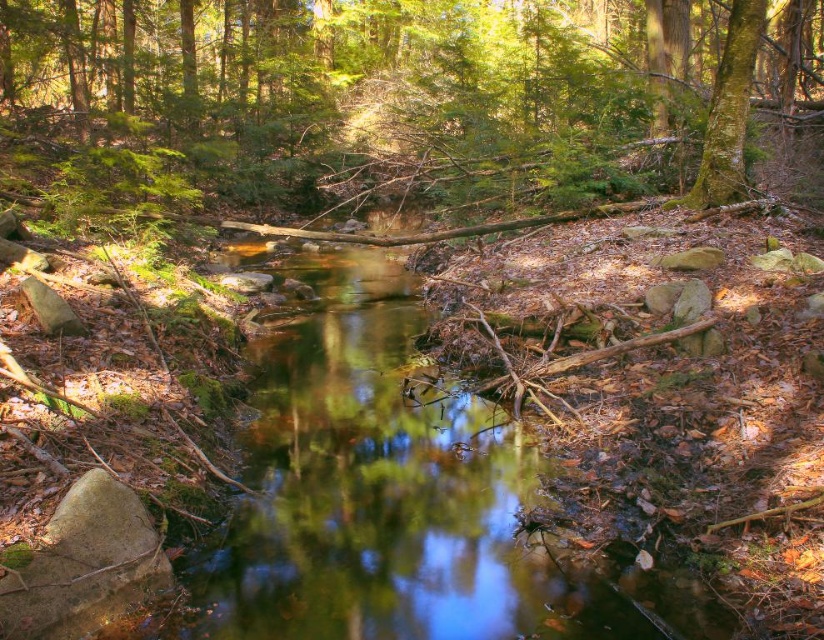
How distant is green matte tree at center from green mossy tree at upper right?

They are 30.10 feet apart.

Does green matte tree at center have a smaller size compared to green mossy tree at upper right?

No, green matte tree at center is not smaller than green mossy tree at upper right.

Between point (302, 154) and point (737, 77), which one is positioned behind?

Positioned behind is point (302, 154).

Where is `green matte tree at center`? green matte tree at center is located at coordinates (406, 99).

Is green matte tree at center wider than green reflective water at center?

Yes.

Between green matte tree at center and green reflective water at center, which one appears on the left side from the viewer's perspective?

green reflective water at center is more to the left.

The image size is (824, 640). What do you see at coordinates (406, 99) in the screenshot? I see `green matte tree at center` at bounding box center [406, 99].

Find the location of a particular element. The height and width of the screenshot is (640, 824). green matte tree at center is located at coordinates (406, 99).

Is point (405, 486) farther from camera compared to point (750, 17)?

No, it is in front of (750, 17).

Does green reflective water at center have a greater width compared to green mossy tree at upper right?

No, green reflective water at center is not wider than green mossy tree at upper right.

Which is behind, point (288, 604) or point (721, 77)?

Point (721, 77)

This screenshot has width=824, height=640. I want to click on green reflective water at center, so click(x=382, y=493).